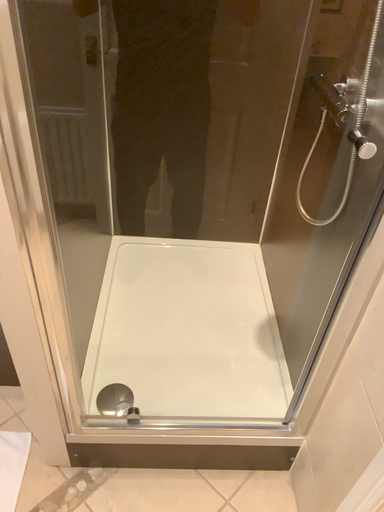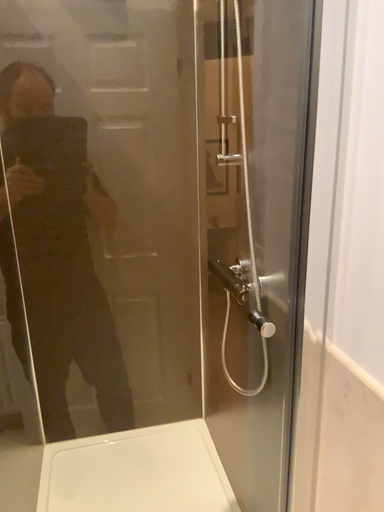
Question: How did the camera likely rotate when shooting the video?

Choices:
 (A) rotated upward
 (B) rotated downward

Answer: (A)